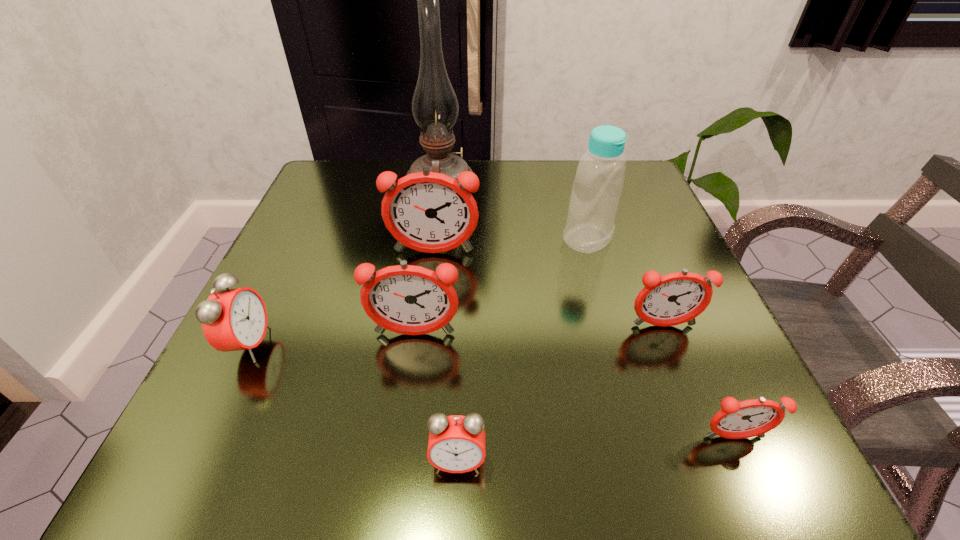
The width and height of the screenshot is (960, 540). What are the coordinates of `vacant space at the far right corner of the desktop` in the screenshot? It's located at (633, 173).

Find the location of a particular element. The width and height of the screenshot is (960, 540). vacant space at the near right corner is located at coordinates (745, 478).

Locate an element on the screen. unoccupied area between the nearest reddish-pink alarm clock and the tallest object is located at coordinates (587, 309).

Locate an element on the screen. This screenshot has height=540, width=960. free space between the leftmost object and the farthest reddish-pink alarm clock is located at coordinates (342, 299).

I want to click on vacant point located between the tallest alarm clock and the second tallest object, so click(x=511, y=246).

Identify the location of free space between the second smallest reddish-pink alarm clock and the right red alarm clock. (561, 393).

Locate an element on the screen. This screenshot has height=540, width=960. vacant space that's between the smaller red alarm clock and the smallest reddish-pink alarm clock is located at coordinates (596, 449).

At what (x,y) coordinates should I click in order to perform the action: click on empty space between the farthest object and the fifth shortest alarm clock. Please return your answer as a coordinate pair (x, y). The height and width of the screenshot is (540, 960). Looking at the image, I should click on (427, 258).

Image resolution: width=960 pixels, height=540 pixels. I want to click on vacant area that lies between the oil lamp and the second tallest alarm clock, so click(427, 258).

The image size is (960, 540). I want to click on free space that is in between the fifth shortest alarm clock and the farthest object, so click(427, 258).